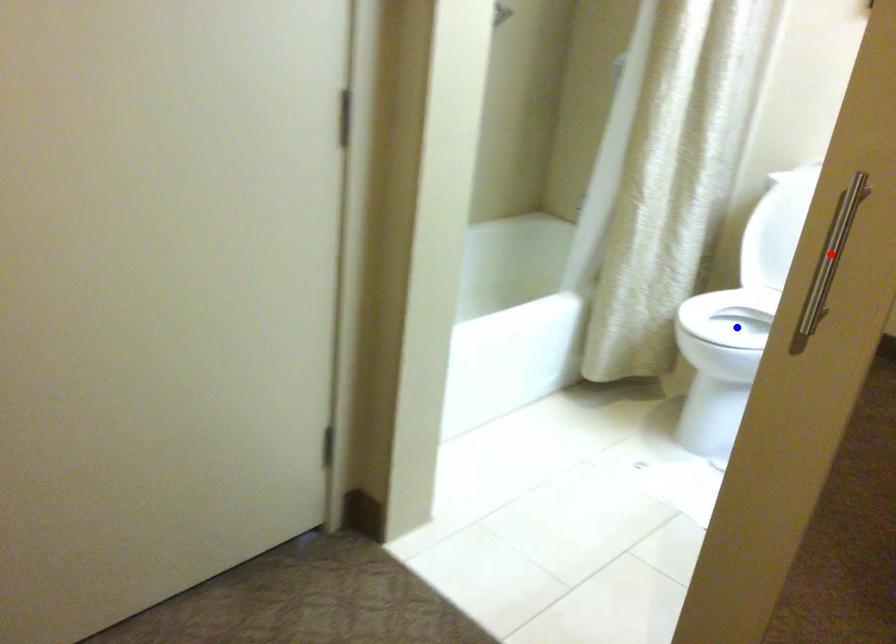
Question: Two points are marked on the image. Which point is closer to the camera?

Choices:
 (A) Blue point is closer.
 (B) Red point is closer.

Answer: (B)